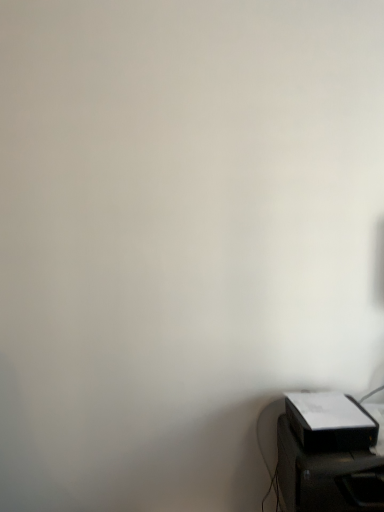
This screenshot has width=384, height=512. What do you see at coordinates (327, 477) in the screenshot?
I see `black plastic printer at lower right` at bounding box center [327, 477].

You are a GUI agent. You are given a task and a screenshot of the screen. Output one action in this format:
    pyautogui.click(x=<x>, y=<y>)
    Task: Click on the black plastic printer at lower right
    This screenshot has width=384, height=512.
    Given the screenshot: What is the action you would take?
    pyautogui.click(x=327, y=477)

Measure the distance between black plastic printer at lower right and camera.

They are 4.32 feet apart.

This screenshot has width=384, height=512. Identify the location of white matte printer at lower right. (330, 422).

Measure the distance between white matte printer at lower right and camera.

They are 1.35 meters apart.

This screenshot has width=384, height=512. Describe the element at coordinates (330, 422) in the screenshot. I see `white matte printer at lower right` at that location.

What is the approximate height of white matte printer at lower right?

The height of white matte printer at lower right is 3.99 inches.

The width and height of the screenshot is (384, 512). In order to click on black plastic printer at lower right in this screenshot , I will do `click(327, 477)`.

Does white matte printer at lower right appear on the left side of black plastic printer at lower right?

Yes, white matte printer at lower right is to the left of black plastic printer at lower right.

Which is in front, white matte printer at lower right or black plastic printer at lower right?

Positioned in front is black plastic printer at lower right.

Which is behind, point (316, 429) or point (363, 457)?

Point (316, 429)

From the image's perspective, does white matte printer at lower right appear higher than black plastic printer at lower right?

Yes, from the image's perspective, white matte printer at lower right is over black plastic printer at lower right.

From a real-world perspective, who is located lower, white matte printer at lower right or black plastic printer at lower right?

In real-world perspective, black plastic printer at lower right is lower.

Between white matte printer at lower right and black plastic printer at lower right, which one has larger width?

black plastic printer at lower right.

Who is shorter, white matte printer at lower right or black plastic printer at lower right?

Standing shorter between the two is white matte printer at lower right.

Looking at the image, does white matte printer at lower right seem bigger or smaller compared to black plastic printer at lower right?

white matte printer at lower right is smaller than black plastic printer at lower right.

In the scene shown: Could black plastic printer at lower right be considered to be inside white matte printer at lower right?

No, black plastic printer at lower right is not inside white matte printer at lower right.

Would you say white matte printer at lower right is a long distance from black plastic printer at lower right?

They are positioned close to each other.

Is black plastic printer at lower right at the back of white matte printer at lower right?

white matte printer at lower right is not turned away from black plastic printer at lower right.

How distant is white matte printer at lower right from black plastic printer at lower right?

3.44 inches.

Where is `furniture directly beneath the white matte printer at lower right (from a real-world perspective)`? This screenshot has height=512, width=384. furniture directly beneath the white matte printer at lower right (from a real-world perspective) is located at coordinates (327, 477).

In the scene shown: Is black plastic printer at lower right at the right side of white matte printer at lower right?

Correct, you'll find black plastic printer at lower right to the right of white matte printer at lower right.

Does black plastic printer at lower right lie behind white matte printer at lower right?

No, black plastic printer at lower right is closer to the viewer.

Considering the positions of point (365, 487) and point (324, 415), is point (365, 487) closer or farther from the camera than point (324, 415)?

Point (365, 487).

From the image's perspective, which object appears higher, black plastic printer at lower right or white matte printer at lower right?

white matte printer at lower right is shown above in the image.

From a real-world perspective, who is located lower, black plastic printer at lower right or white matte printer at lower right?

black plastic printer at lower right is physically lower.

Considering the sizes of objects black plastic printer at lower right and white matte printer at lower right in the image provided, who is wider, black plastic printer at lower right or white matte printer at lower right?

Wider between the two is black plastic printer at lower right.

Considering the sizes of objects black plastic printer at lower right and white matte printer at lower right in the image provided, who is shorter, black plastic printer at lower right or white matte printer at lower right?

Standing shorter between the two is white matte printer at lower right.

Can you confirm if black plastic printer at lower right is bigger than white matte printer at lower right?

Indeed, black plastic printer at lower right has a larger size compared to white matte printer at lower right.

Can we say black plastic printer at lower right lies outside white matte printer at lower right?

Indeed, black plastic printer at lower right is completely outside white matte printer at lower right.

From the picture: Is black plastic printer at lower right not near white matte printer at lower right?

No, black plastic printer at lower right is not far from white matte printer at lower right.

Does black plastic printer at lower right turn towards white matte printer at lower right?

No, black plastic printer at lower right is not oriented towards white matte printer at lower right.

Can you tell me how much black plastic printer at lower right and white matte printer at lower right differ in facing direction?

black plastic printer at lower right and white matte printer at lower right are facing 0.0002 degrees away from each other.

How distant is black plastic printer at lower right from white matte printer at lower right?

They are 8.74 centimeters apart.

You are a GUI agent. You are given a task and a screenshot of the screen. Output one action in this format:
    pyautogui.click(x=<x>, y=<y>)
    Task: Click on the printer that appears on the left of black plastic printer at lower right
    
    Given the screenshot: What is the action you would take?
    pyautogui.click(x=330, y=422)

I want to click on furniture lying below the white matte printer at lower right (from the image's perspective), so click(327, 477).

Where is `furniture in front of the white matte printer at lower right`? The image size is (384, 512). furniture in front of the white matte printer at lower right is located at coordinates (327, 477).